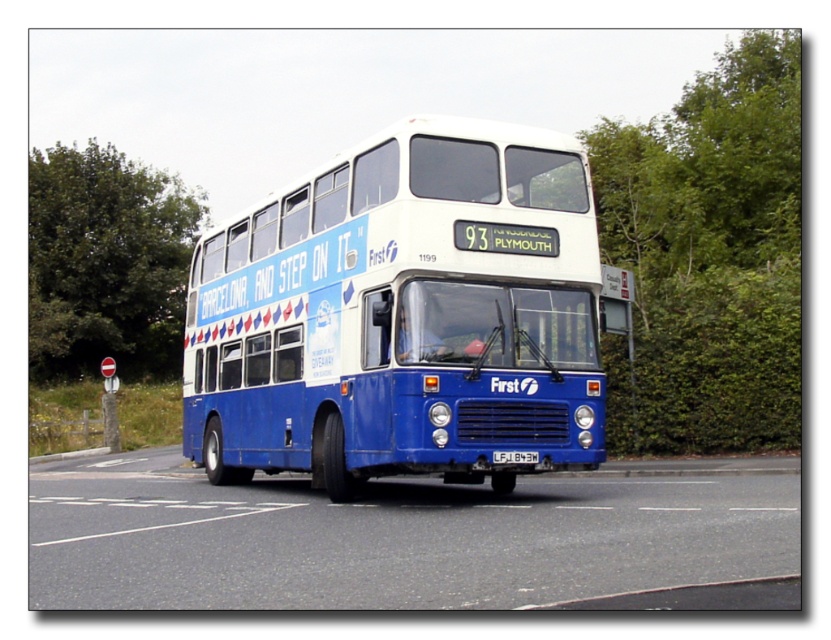
Measure the distance from blue metallic bus at center to green leafy tree at left.

72.61 feet

Which is behind, point (374, 301) or point (28, 182)?

Positioned behind is point (28, 182).

Locate an element on the screen. This screenshot has width=831, height=640. blue metallic bus at center is located at coordinates (402, 316).

At what (x,y) coordinates should I click in order to perform the action: click on blue metallic bus at center. Please return your answer as a coordinate pair (x, y). Looking at the image, I should click on coord(402,316).

Describe the element at coordinates (106, 262) in the screenshot. I see `green leafy tree at left` at that location.

Who is more distant from viewer, (94, 269) or (529, 451)?

The point (94, 269) is more distant.

The image size is (831, 640). Find the location of `green leafy tree at left`. green leafy tree at left is located at coordinates (106, 262).

Looking at this image, can you confirm if blue metallic bus at center is wider than white plastic license plate at center?

Indeed, blue metallic bus at center has a greater width compared to white plastic license plate at center.

How far apart are blue metallic bus at center and white plastic license plate at center?

blue metallic bus at center and white plastic license plate at center are 3.27 meters apart.

Is point (507, 216) farther from viewer compared to point (505, 461)?

Yes, it is.

Locate an element on the screen. This screenshot has width=831, height=640. blue metallic bus at center is located at coordinates (402, 316).